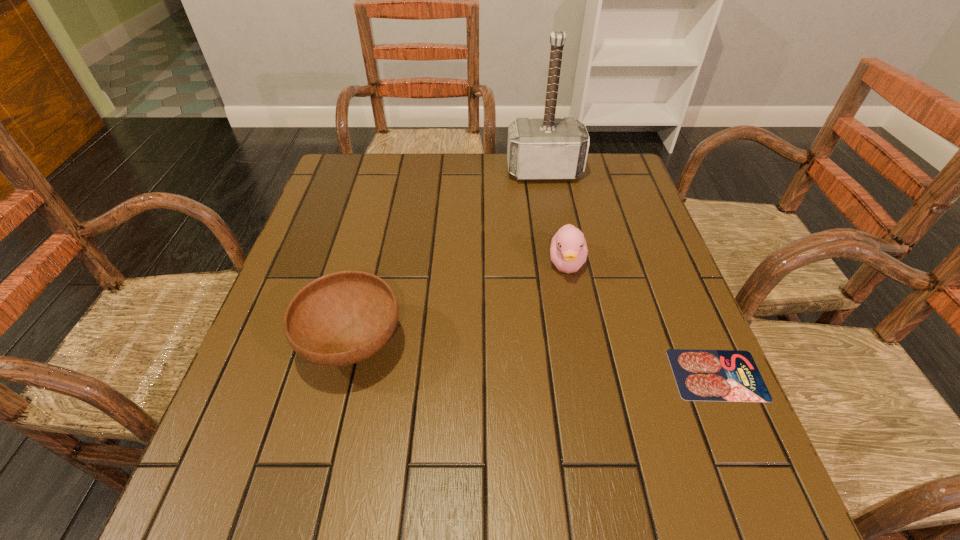
Find the location of a particular element. This screenshot has height=540, width=960. bowl is located at coordinates (342, 318).

Identify the location of the rightmost object. (701, 375).

Find the location of a particular element. the shortest object is located at coordinates (701, 375).

Locate an element on the screen. The image size is (960, 540). the third nearest object is located at coordinates (568, 251).

You are a GUI agent. You are given a task and a screenshot of the screen. Output one action in this format:
    pyautogui.click(x=<x>, y=<y>)
    Task: Click on the tallest object
    Image resolution: width=960 pixels, height=540 pixels.
    Given the screenshot: What is the action you would take?
    pyautogui.click(x=549, y=148)

Locate an element on the screen. This screenshot has height=540, width=960. hammer is located at coordinates (549, 148).

You are a GUI agent. You are given a task and a screenshot of the screen. Output one action in this format:
    pyautogui.click(x=<x>, y=<y>)
    Task: Click on the free location located on the right of the leftmost object
    The image size is (960, 540).
    Given the screenshot: What is the action you would take?
    pyautogui.click(x=598, y=345)

Locate an element on the screen. vacant space located 0.090m on the left of the salami is located at coordinates (626, 374).

Locate an element on the screen. vacant space located on the front-facing side of the third nearest object is located at coordinates (573, 323).

Where is `free region located 0.290m on the front-facing side of the third nearest object`? free region located 0.290m on the front-facing side of the third nearest object is located at coordinates (581, 402).